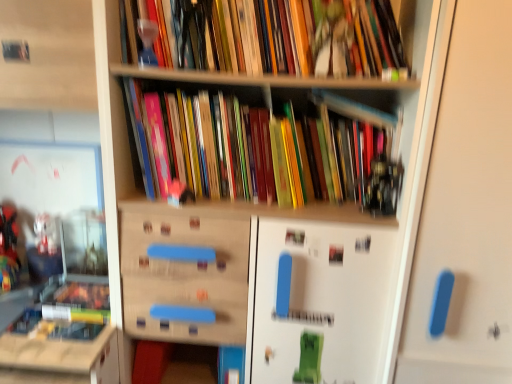
Where is `white matte door at right`? Image resolution: width=512 pixels, height=384 pixels. white matte door at right is located at coordinates (467, 211).

Describe the element at coordinates (264, 152) in the screenshot. The height and width of the screenshot is (384, 512). I see `multicolored paperbacks at center, the 2th book in the top-to-bottom sequence` at that location.

The width and height of the screenshot is (512, 384). I want to click on wooden bookshelf at left, so (x=61, y=359).

Image resolution: width=512 pixels, height=384 pixels. Find the location of `translucent glass trophy at upper center`. translucent glass trophy at upper center is located at coordinates (147, 41).

Between hardcover books at upper center, which is the 2th book from bottom to top, and white matte door at right, which one has larger width?

white matte door at right is wider.

From a real-world perspective, who is located higher, hardcover books at upper center, which is the first book in top-to-bottom order, or white matte door at right?

From a 3D spatial view, hardcover books at upper center, which is the first book in top-to-bottom order, is above.

Which object is positioned more to the right, hardcover books at upper center, which is the 2th book from bottom to top, or white matte door at right?

white matte door at right is more to the right.

Which object is positioned more to the right, hardcover books at upper center, which is the 2th book from bottom to top, or translucent glass trophy at upper center?

From the viewer's perspective, hardcover books at upper center, which is the 2th book from bottom to top, appears more on the right side.

Is translucent glass trophy at upper center completely or partially inside hardcover books at upper center, which is the 2th book from bottom to top?

Yes.

Does hardcover books at upper center, which is the 2th book from bottom to top, have a lesser width compared to translucent glass trophy at upper center?

Incorrect, the width of hardcover books at upper center, which is the 2th book from bottom to top, is not less than that of translucent glass trophy at upper center.

Locate an element on the screen. This screenshot has width=512, height=384. book that appears above the translucent glass trophy at upper center (from a real-world perspective) is located at coordinates (279, 37).

From a real-world perspective, is multicolored paperbacks at center, the first book in the bottom-to-top sequence, physically below white matte door at right?

No, from a real-world perspective, multicolored paperbacks at center, the first book in the bottom-to-top sequence, is not below white matte door at right.

Is multicolored paperbacks at center, the 2th book in the top-to-bottom sequence, positioned before white matte door at right?

No, it is behind white matte door at right.

This screenshot has width=512, height=384. I want to click on book that is the 2nd object located behind the white matte door at right, so click(264, 152).

Based on the photo, considering the sizes of objects translucent glass trophy at upper center and multicolored paperbacks at center, the 2th book in the top-to-bottom sequence, in the image provided, who is shorter, translucent glass trophy at upper center or multicolored paperbacks at center, the 2th book in the top-to-bottom sequence,?

With less height is translucent glass trophy at upper center.

Is translucent glass trophy at upper center positioned with its back to multicolored paperbacks at center, the 2th book in the top-to-bottom sequence?

No, translucent glass trophy at upper center's orientation is not away from multicolored paperbacks at center, the 2th book in the top-to-bottom sequence.

Is translucent glass trophy at upper center touching multicolored paperbacks at center, the 2th book in the top-to-bottom sequence?

No, translucent glass trophy at upper center is not next to multicolored paperbacks at center, the 2th book in the top-to-bottom sequence.

Is translucent glass trophy at upper center bigger than multicolored paperbacks at center, the first book in the bottom-to-top sequence?

Incorrect, translucent glass trophy at upper center is not larger than multicolored paperbacks at center, the first book in the bottom-to-top sequence.

From a real-world perspective, is wooden bookshelf at left physically below translucent glass trophy at upper center?

Yes, from a real-world perspective, wooden bookshelf at left is below translucent glass trophy at upper center.

Is wooden bookshelf at left far away from translucent glass trophy at upper center?

They are positioned close to each other.

How much distance is there between wooden bookshelf at left and translucent glass trophy at upper center?

They are 24.37 inches apart.

From the image's perspective, between wooden bookshelf at left and translucent glass trophy at upper center, which one is located above?

translucent glass trophy at upper center is shown above in the image.

Which is further, (365, 111) or (64, 349)?

Point (365, 111)

From the image's perspective, is multicolored paperbacks at center, the 2th book in the top-to-bottom sequence, located above or below wooden bookshelf at left?

From the image's perspective, multicolored paperbacks at center, the 2th book in the top-to-bottom sequence, appears above wooden bookshelf at left.

Which object is closer to the camera, multicolored paperbacks at center, the 2th book in the top-to-bottom sequence, or wooden bookshelf at left?

Positioned in front is wooden bookshelf at left.

Is multicolored paperbacks at center, the 2th book in the top-to-bottom sequence, shorter than wooden bookshelf at left?

Yes.

Is white matte door at right thinner than multicolored paperbacks at center, the 2th book in the top-to-bottom sequence?

In fact, white matte door at right might be wider than multicolored paperbacks at center, the 2th book in the top-to-bottom sequence.

Do you think white matte door at right is within multicolored paperbacks at center, the 2th book in the top-to-bottom sequence, or outside of it?

white matte door at right is located beyond the bounds of multicolored paperbacks at center, the 2th book in the top-to-bottom sequence.

Consider the image. How much distance is there between white matte door at right and multicolored paperbacks at center, the first book in the bottom-to-top sequence?

38.20 centimeters.

I want to click on door on the right of hardcover books at upper center, which is the first book in top-to-bottom order, so click(467, 211).

Identify the location of toy below the hardcover books at upper center, which is the 2th book from bottom to top (from the image's perspective). (147, 41).

Based on their spatial positions, is hardcover books at upper center, which is the first book in top-to-bottom order, or translucent glass trophy at upper center further from multicolored paperbacks at center, the 2th book in the top-to-bottom sequence?

translucent glass trophy at upper center is further to multicolored paperbacks at center, the 2th book in the top-to-bottom sequence.

Looking at the image, which one is located further to wooden bookshelf at left, hardcover books at upper center, which is the 2th book from bottom to top, or white matte door at right?

white matte door at right.

From the image, which object appears to be nearer to hardcover books at upper center, which is the first book in top-to-bottom order, white matte door at right or multicolored paperbacks at center, the 2th book in the top-to-bottom sequence?

The object closer to hardcover books at upper center, which is the first book in top-to-bottom order, is multicolored paperbacks at center, the 2th book in the top-to-bottom sequence.

Looking at this image, estimate the real-world distances between objects in this image. Which object is closer to white matte door at right, hardcover books at upper center, which is the first book in top-to-bottom order, or translucent glass trophy at upper center?

Among the two, hardcover books at upper center, which is the first book in top-to-bottom order, is located nearer to white matte door at right.

Looking at the image, which one is located further to wooden bookshelf at left, white matte door at right or multicolored paperbacks at center, the first book in the bottom-to-top sequence?

white matte door at right is positioned further to the anchor wooden bookshelf at left.

Based on the photo, when comparing their distances from wooden bookshelf at left, does multicolored paperbacks at center, the first book in the bottom-to-top sequence, or translucent glass trophy at upper center seem closer?

multicolored paperbacks at center, the first book in the bottom-to-top sequence, is positioned closer to the anchor wooden bookshelf at left.

Estimate the real-world distances between objects in this image. Which object is closer to wooden bookshelf at left, translucent glass trophy at upper center or multicolored paperbacks at center, the 2th book in the top-to-bottom sequence?

Based on the image, multicolored paperbacks at center, the 2th book in the top-to-bottom sequence, appears to be nearer to wooden bookshelf at left.

When comparing their distances from wooden bookshelf at left, does translucent glass trophy at upper center or hardcover books at upper center, which is the 2th book from bottom to top, seem further?

translucent glass trophy at upper center.

Identify the location of toy between wooden bookshelf at left and hardcover books at upper center, which is the first book in top-to-bottom order, from left to right. (147, 41).

I want to click on book between translucent glass trophy at upper center and hardcover books at upper center, which is the 2th book from bottom to top, in the horizontal direction, so click(x=264, y=152).

What are the coordinates of `toy situated between wooden bookshelf at left and multicolored paperbacks at center, the 2th book in the top-to-bottom sequence, from left to right` in the screenshot? It's located at (147, 41).

At what (x,y) coordinates should I click in order to perform the action: click on toy between wooden bookshelf at left and white matte door at right from left to right. Please return your answer as a coordinate pair (x, y). The image size is (512, 384). Looking at the image, I should click on (147, 41).